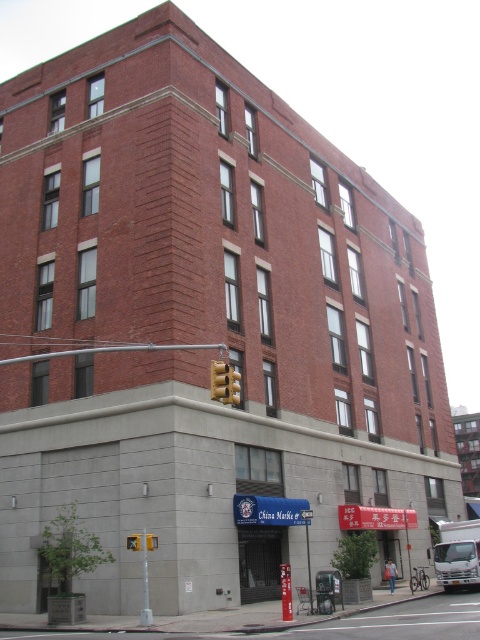
You are standing at the corner of the building and looking at the traffic signal and the small tree. Which of the two points, point (215, 397) or point (139, 532), is closer to you?

Point (215, 397) is closer to the camera than point (139, 532), so it is closer to you.

You are a pedestrian trying to cross the street at the intersection near the multi story brick building. You see two yellow traffic lights, the yellow matte traffic light at upper center and the yellow plastic traffic light at lower center. Which one is closer to you?

The yellow matte traffic light at upper center is closer to you because it is in front of the yellow plastic traffic light at lower center.

Consider the image. You are a pedestrian standing at the intersection and see the yellow matte traffic light at upper center and the yellow plastic traffic light at upper center. Which one appears closer to you?

The yellow matte traffic light at upper center appears closer because it is in front of the yellow plastic traffic light at upper center.